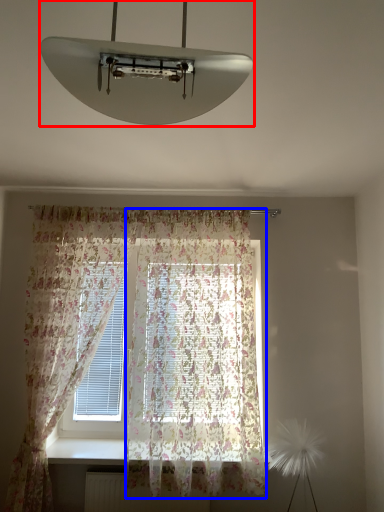
Question: Among these objects, which one is farthest to the camera, lamp (highlighted by a red box) or curtain (highlighted by a blue box)?

Choices:
 (A) lamp
 (B) curtain

Answer: (B)